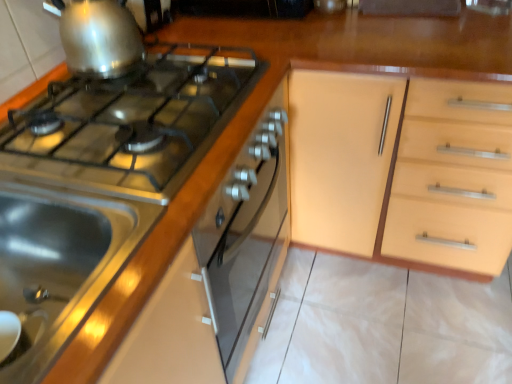
The width and height of the screenshot is (512, 384). Find the location of `free space above stainless steel stove at upper left, the second kitchen appliance when ordered from top to bottom (from a real-world perspective)`. free space above stainless steel stove at upper left, the second kitchen appliance when ordered from top to bottom (from a real-world perspective) is located at coordinates (114, 141).